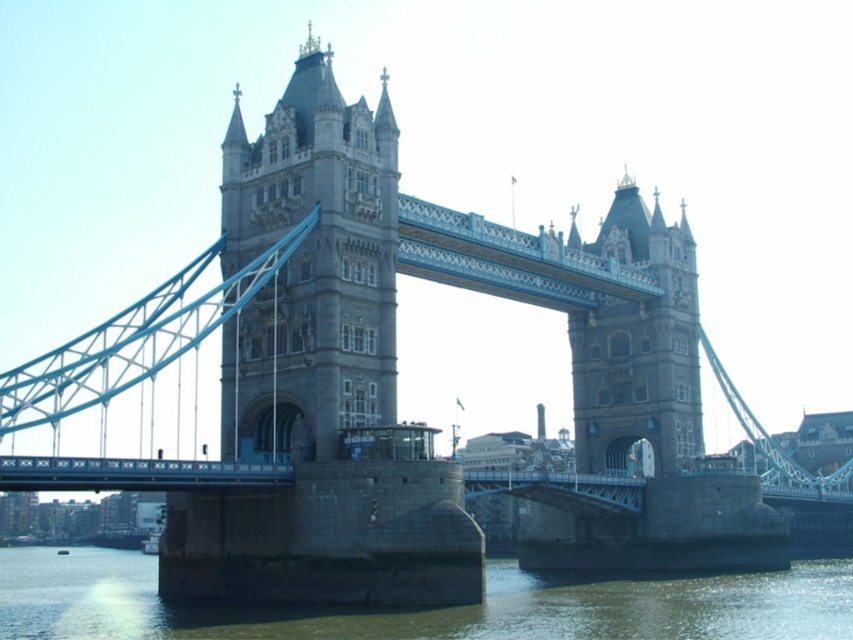
Which is more to the left, gray stone tower at center or greenish concrete river at lower center?

From the viewer's perspective, greenish concrete river at lower center appears more on the left side.

Identify the location of gray stone tower at center. (310, 268).

Is greenish concrete river at lower center below stone stonework tower at center?

Correct, greenish concrete river at lower center is located below stone stonework tower at center.

Is point (633, 616) positioned behind point (664, 250)?

No, it is in front of (664, 250).

Image resolution: width=853 pixels, height=640 pixels. Describe the element at coordinates (422, 611) in the screenshot. I see `greenish concrete river at lower center` at that location.

Identify the location of greenish concrete river at lower center. The image size is (853, 640). (422, 611).

Is gray stone tower at center positioned behind stone stonework tower at center?

No.

Between point (242, 253) and point (677, 296), which one is positioned behind?

Positioned behind is point (677, 296).

This screenshot has height=640, width=853. What do you see at coordinates (310, 268) in the screenshot?
I see `gray stone tower at center` at bounding box center [310, 268].

At what (x,y) coordinates should I click in order to perform the action: click on gray stone tower at center. Please return your answer as a coordinate pair (x, y). The height and width of the screenshot is (640, 853). Looking at the image, I should click on (310, 268).